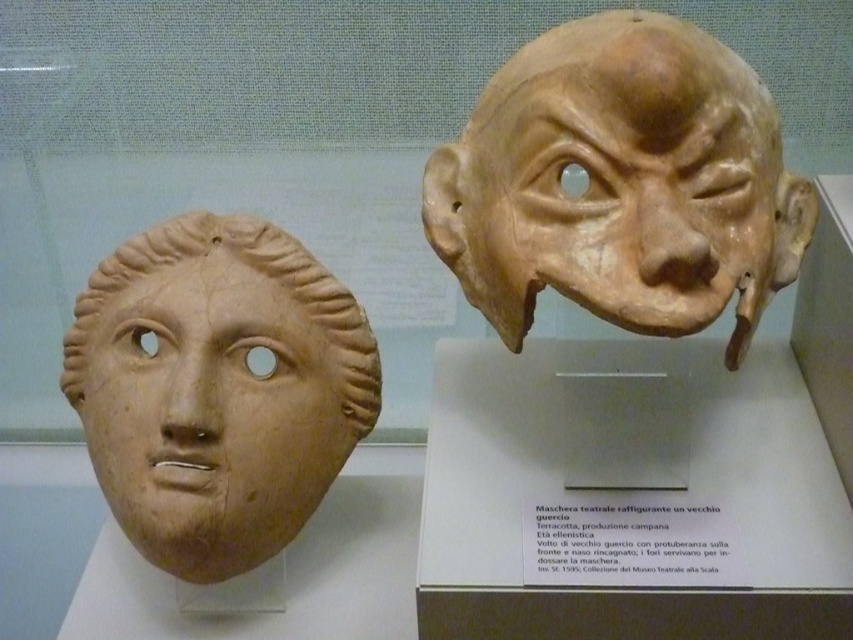
Who is more forward, (692, 129) or (125, 509)?

Point (692, 129) is in front.

The image size is (853, 640). I want to click on matte clay mask at upper right, so click(621, 182).

The width and height of the screenshot is (853, 640). I want to click on matte clay mask at upper right, so click(621, 182).